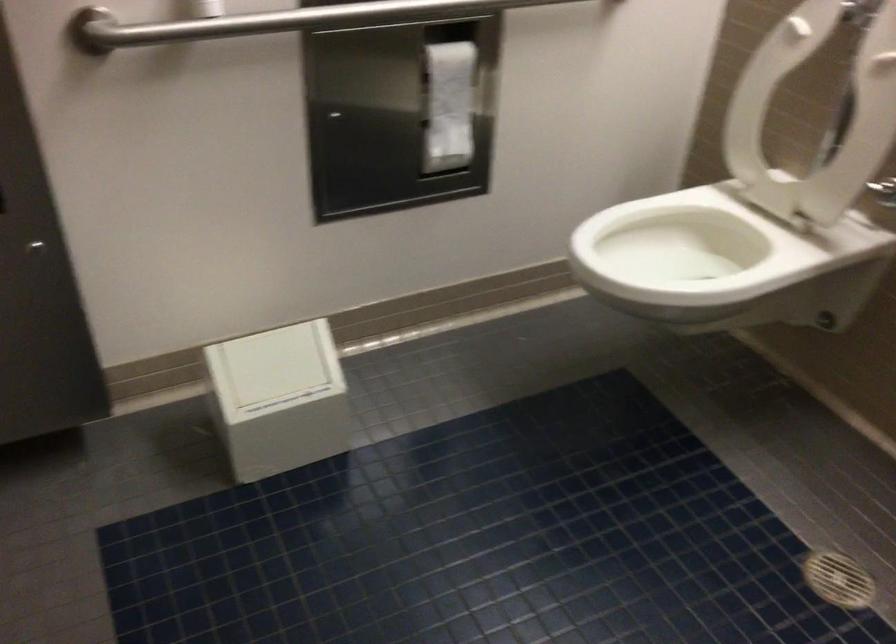
What are the coordinates of `small white box` in the screenshot? It's located at (279, 399).